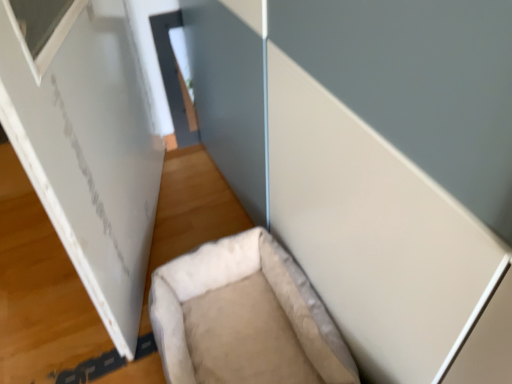
Image resolution: width=512 pixels, height=384 pixels. What do you see at coordinates (234, 282) in the screenshot?
I see `beige fabric pet bed at lower center` at bounding box center [234, 282].

You are a GUI agent. You are given a task and a screenshot of the screen. Output one action in this format:
    pyautogui.click(x=<x>, y=<y>)
    Task: Click on the beige fabric pet bed at lower center
    
    Given the screenshot: What is the action you would take?
    234,282

What is the approximate height of white matte board at left?

white matte board at left is 32.57 inches in height.

Measure the distance between white matte board at left and camera.

A: white matte board at left and camera are 21.98 inches apart.

What do you see at coordinates (88, 149) in the screenshot? I see `white matte board at left` at bounding box center [88, 149].

Identify the location of white matte board at left. (88, 149).

Find the location of a particular element. The image size is (512, 384). beige fabric pet bed at lower center is located at coordinates (234, 282).

In the image, is white matte board at left on the left side or the right side of beige fabric pet bed at lower center?

Clearly, white matte board at left is on the left of beige fabric pet bed at lower center in the image.

Does white matte board at left come in front of beige fabric pet bed at lower center?

Yes, the depth of white matte board at left is less than that of beige fabric pet bed at lower center.

Does point (57, 77) lie in front of point (213, 245)?

That is True.

From the image's perspective, is white matte board at left above beige fabric pet bed at lower center?

Correct, white matte board at left appears higher than beige fabric pet bed at lower center in the image.

From a real-world perspective, which is physically above, white matte board at left or beige fabric pet bed at lower center?

In real-world perspective, white matte board at left is above.

Consider the image. Considering the sizes of objects white matte board at left and beige fabric pet bed at lower center in the image provided, who is wider, white matte board at left or beige fabric pet bed at lower center?

beige fabric pet bed at lower center is wider.

In terms of height, does white matte board at left look taller or shorter compared to beige fabric pet bed at lower center?

Clearly, white matte board at left is taller compared to beige fabric pet bed at lower center.

Considering the relative sizes of white matte board at left and beige fabric pet bed at lower center in the image provided, is white matte board at left smaller than beige fabric pet bed at lower center?

Actually, white matte board at left might be larger than beige fabric pet bed at lower center.

Is beige fabric pet bed at lower center a part of white matte board at left?

Actually, beige fabric pet bed at lower center is outside white matte board at left.

In the scene shown: Are white matte board at left and beige fabric pet bed at lower center beside each other?

No.

Is white matte board at left positioned with its back to beige fabric pet bed at lower center?

Yes.

How many degrees apart are the facing directions of white matte board at left and beige fabric pet bed at lower center?

20 degrees.

The width and height of the screenshot is (512, 384). In order to click on bulletin board in front of the beige fabric pet bed at lower center in this screenshot , I will do `click(88, 149)`.

Considering the positions of objects beige fabric pet bed at lower center and white matte board at left in the image provided, who is more to the right, beige fabric pet bed at lower center or white matte board at left?

beige fabric pet bed at lower center is more to the right.

In the image, is beige fabric pet bed at lower center positioned in front of or behind white matte board at left?

Visually, beige fabric pet bed at lower center is located behind white matte board at left.

Does point (263, 262) appear closer or farther from the camera than point (112, 246)?

Point (263, 262).

From the image's perspective, which one is positioned higher, beige fabric pet bed at lower center or white matte board at left?

white matte board at left is shown above in the image.

From a real-world perspective, relative to white matte board at left, is beige fabric pet bed at lower center vertically above or below?

In terms of real-world spatial position, beige fabric pet bed at lower center is below white matte board at left.

Can you confirm if beige fabric pet bed at lower center is thinner than white matte board at left?

In fact, beige fabric pet bed at lower center might be wider than white matte board at left.

From the picture: Between beige fabric pet bed at lower center and white matte board at left, which one has more height?

Standing taller between the two is white matte board at left.

Considering the relative sizes of beige fabric pet bed at lower center and white matte board at left in the image provided, is beige fabric pet bed at lower center smaller than white matte board at left?

Yes, beige fabric pet bed at lower center is smaller than white matte board at left.

Is beige fabric pet bed at lower center completely or partially outside of white matte board at left?

beige fabric pet bed at lower center is positioned outside white matte board at left.

Is beige fabric pet bed at lower center far away from white matte board at left?

No, there isn't a large distance between beige fabric pet bed at lower center and white matte board at left.

Is beige fabric pet bed at lower center turned away from white matte board at left?

No, white matte board at left is not at the back of beige fabric pet bed at lower center.

Can you tell me how much beige fabric pet bed at lower center and white matte board at left differ in facing direction?

The facing directions of beige fabric pet bed at lower center and white matte board at left are 20 degrees apart.

How distant is beige fabric pet bed at lower center from white matte board at left?

A distance of 13.05 inches exists between beige fabric pet bed at lower center and white matte board at left.

The height and width of the screenshot is (384, 512). I want to click on bulletin board in front of the beige fabric pet bed at lower center, so click(88, 149).

What are the coordinates of `furniture located below the white matte board at left (from the image's perspective)` in the screenshot? It's located at (234, 282).

I want to click on furniture on the right of the white matte board at left, so click(x=234, y=282).